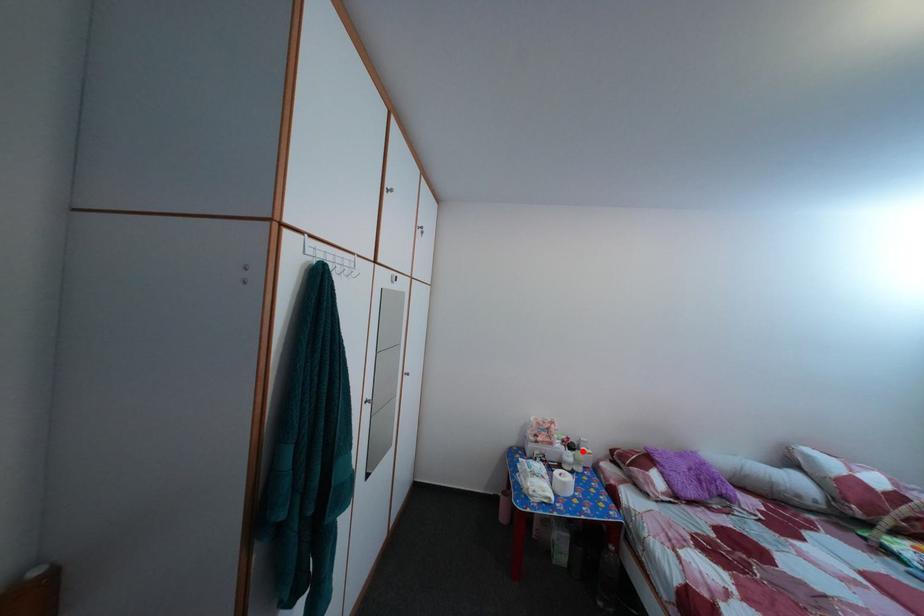
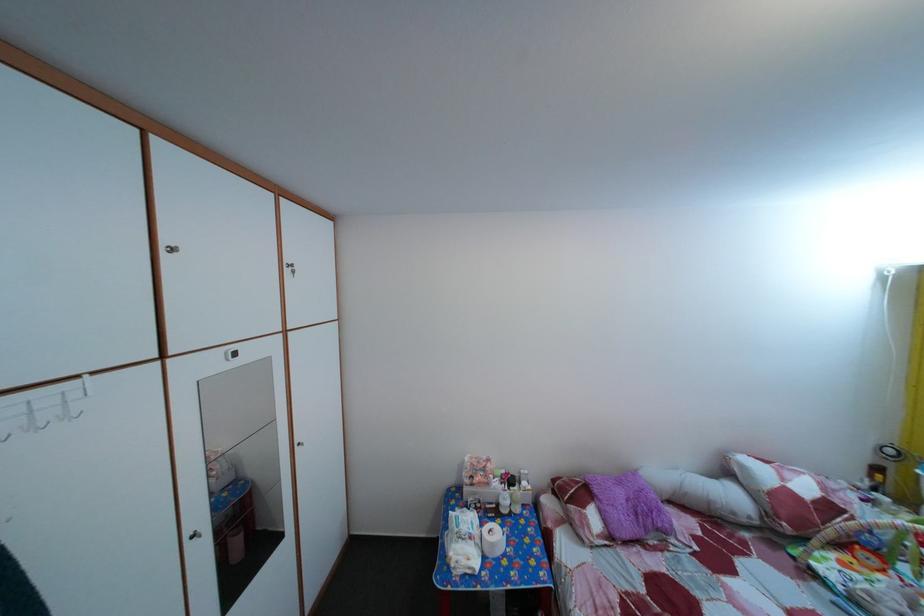
Question: I am providing you with two images of the same scene from different viewpoints. Image1 has a red point marked. In image2, the corresponding 3D location appears at what relative position? Reply with the corresponding letter.

Choices:
 (A) Closer
 (B) Farther

Answer: (A)